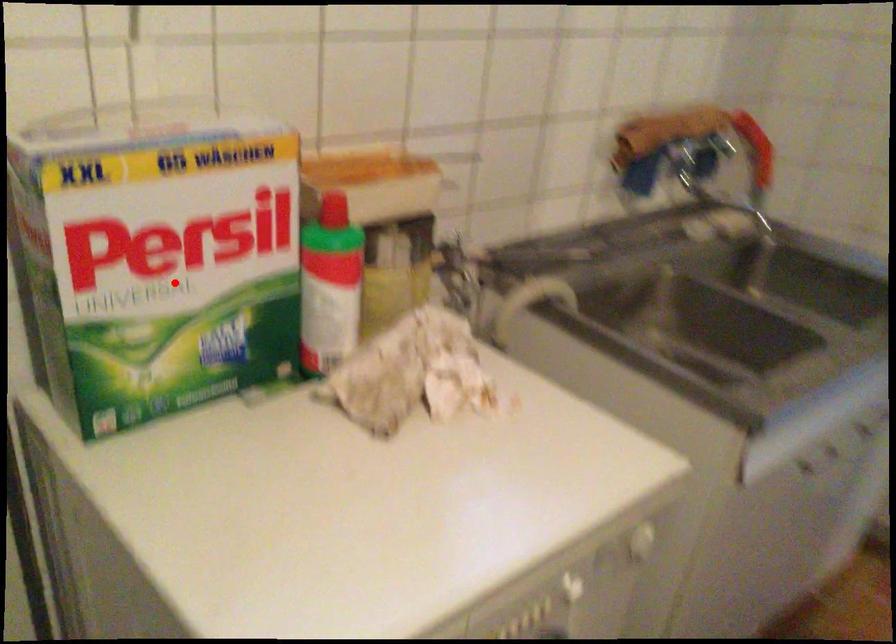
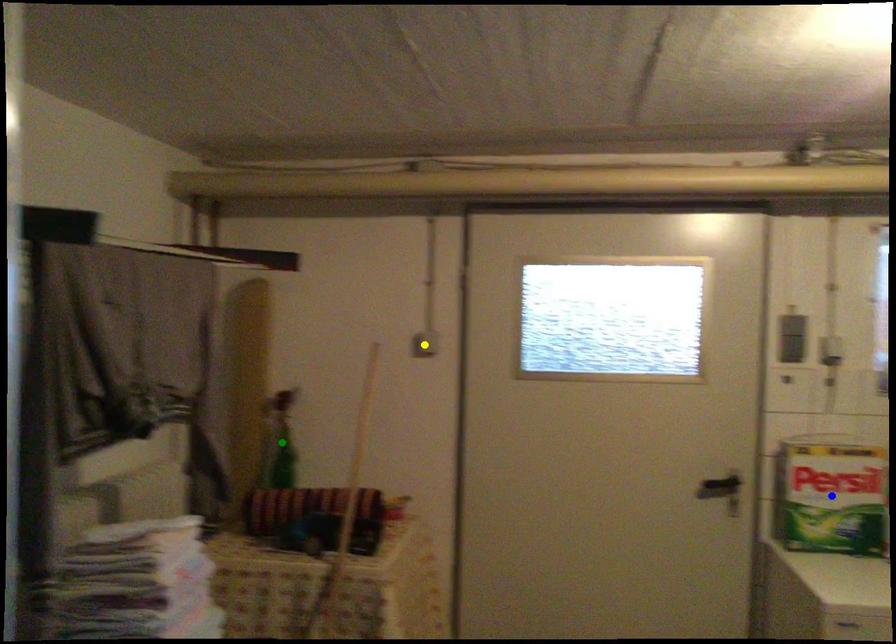
Question: I am providing you with two images of the same scene from different viewpoints. A red point is marked on the first image. You are given multiple points on the second image. Which point in image 2 represents the same 3d spot as the red point in image 1?

Choices:
 (A) blue point
 (B) green point
 (C) yellow point

Answer: (A)